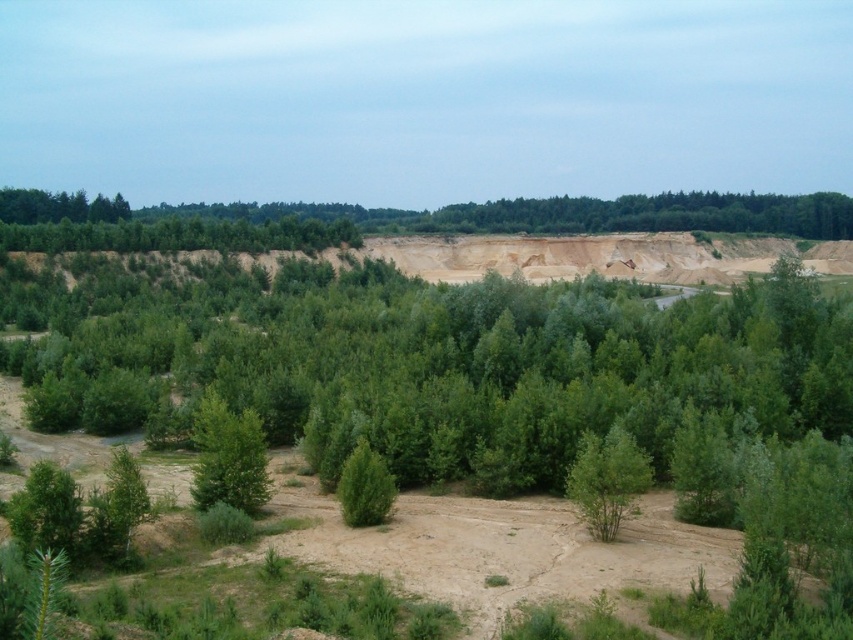
Question: Can you confirm if green leafy bush at center is positioned to the left of green matte tree at center?

Choices:
 (A) no
 (B) yes

Answer: (A)

Question: Is green leafy tree at center in front of green matte tree at center?

Choices:
 (A) no
 (B) yes

Answer: (A)

Question: Does green leafy tree at center appear on the right side of green leafy bush at center?

Choices:
 (A) no
 (B) yes

Answer: (A)

Question: Which object is closer to the camera taking this photo?

Choices:
 (A) green leafy bush at center
 (B) green leafy tree at center
 (C) green matte tree at center

Answer: (A)

Question: Which of the following is the closest to the observer?

Choices:
 (A) (204, 449)
 (B) (618, 435)

Answer: (B)

Question: Which point is closer to the camera?

Choices:
 (A) (624, 460)
 (B) (222, 444)
 (C) (347, 522)

Answer: (A)